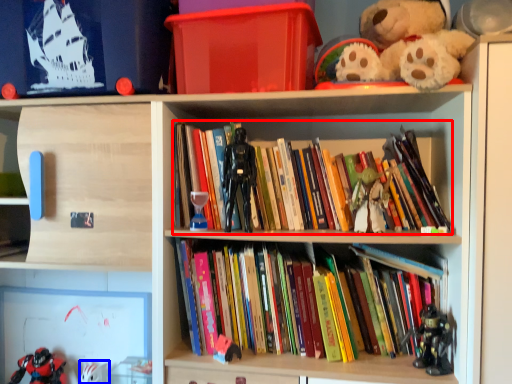
Question: Which object is closer to the camera taking this photo, book (highlighted by a red box) or toy (highlighted by a blue box)?

Choices:
 (A) book
 (B) toy

Answer: (A)